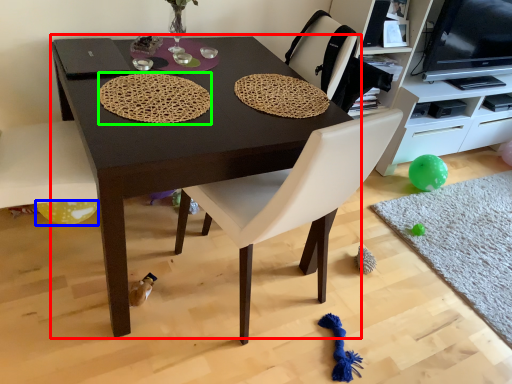
Question: Which is nearer to the table (highlighted by a red box)? balloon (highlighted by a blue box) or mat (highlighted by a green box).

Choices:
 (A) balloon
 (B) mat

Answer: (B)